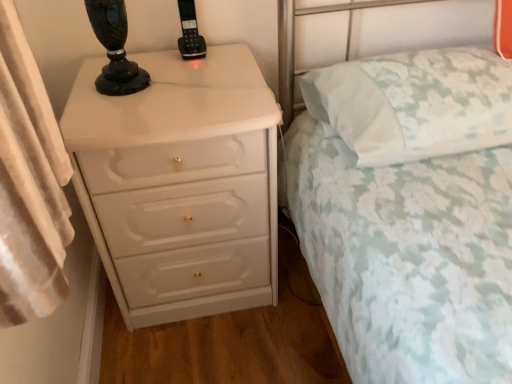
Identify the location of free space above white glossy chest of drawers at left (from a real-world perspective). (154, 84).